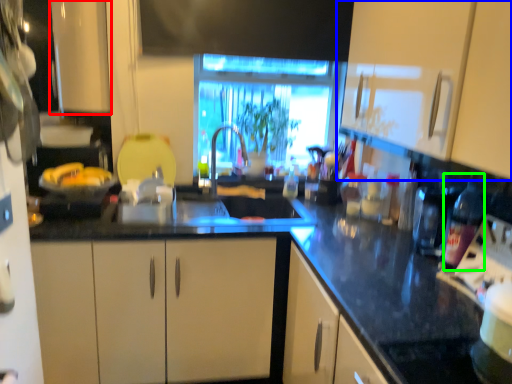
Question: Estimate the real-world distances between objects in this image. Which object is closer to cabinetry (highlighted by a red box), cabinetry (highlighted by a blue box) or bottle (highlighted by a green box)?

Choices:
 (A) cabinetry
 (B) bottle

Answer: (A)